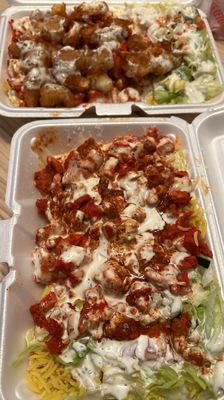
The width and height of the screenshot is (224, 400). Identify the location of table surface. (5, 129).